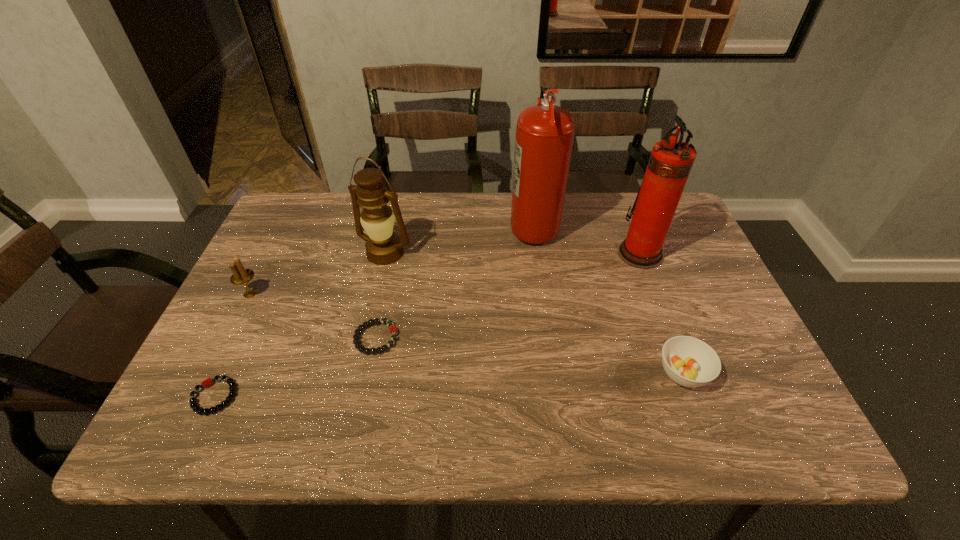
Where is `unoccupied area between the nearer bracelet and the farther bracelet`? unoccupied area between the nearer bracelet and the farther bracelet is located at coordinates (296, 367).

Find the location of a particular element. vacant space that's between the left fire extinguisher and the second tallest object is located at coordinates 587,239.

Locate an element on the screen. The width and height of the screenshot is (960, 540). the closest object to the oil lamp is located at coordinates (393, 331).

At what (x,y) coordinates should I click in order to perform the action: click on the fifth closest object to the oil lamp. Please return your answer as a coordinate pair (x, y). The width and height of the screenshot is (960, 540). Looking at the image, I should click on (670, 162).

Find the location of `vacant position in the image that satisfies the following two spatial constraints: 1. on the front side of the nearer bracelet; 2. on the left side of the candle holder`. vacant position in the image that satisfies the following two spatial constraints: 1. on the front side of the nearer bracelet; 2. on the left side of the candle holder is located at coordinates (199, 396).

What are the coordinates of `free space that satisfies the following two spatial constraints: 1. on the back side of the soup bowl; 2. on the left side of the nearer bracelet` in the screenshot? It's located at (226, 373).